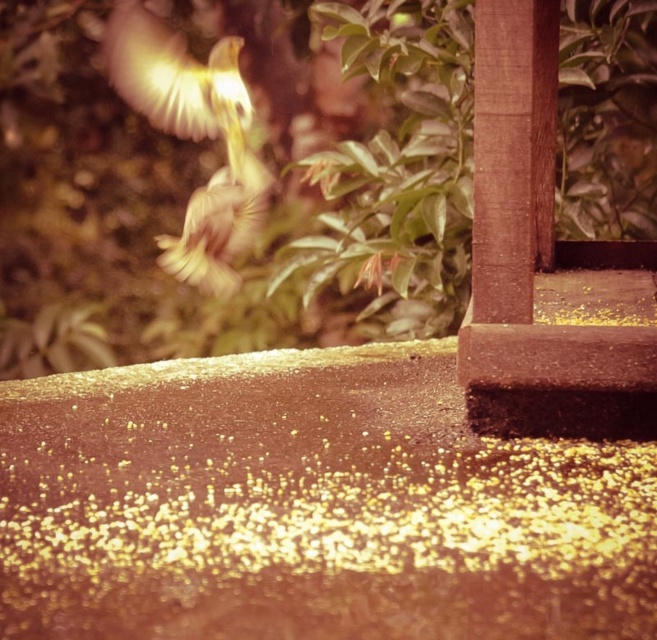
You are a photographer aiming to capture the translucent yellow bird at upper left and the light brown feathers at center in a single shot. Based on their positions, which object should you adjust your camera focus to first to ensure both are in frame?

The translucent yellow bird at upper left is to the left of light brown feathers at center, so you should first focus on the translucent yellow bird at upper left to ensure both are within the frame.

You are a photographer aiming to capture a closeup shot of the translucent yellow bird at upper left and the light brown feathers at center. Given that your camera lens has a maximum focus range of 8 inches, will you be able to focus on both subjects simultaneously?

The distance between the translucent yellow bird at upper left and the light brown feathers at center is 8.06 inches. Since the camera lens has a maximum focus range of 8 inches, it cannot focus on both subjects simultaneously as the required distance exceeds the lens capability.

You are an ornithologist observing a bird in flight. You notice the translucent yellow bird at upper left and light brown feathers at center. Which object is higher in the image?

The translucent yellow bird at upper left is higher in the image because it is positioned in the upper left quadrant, while the light brown feathers at center are located at the center.